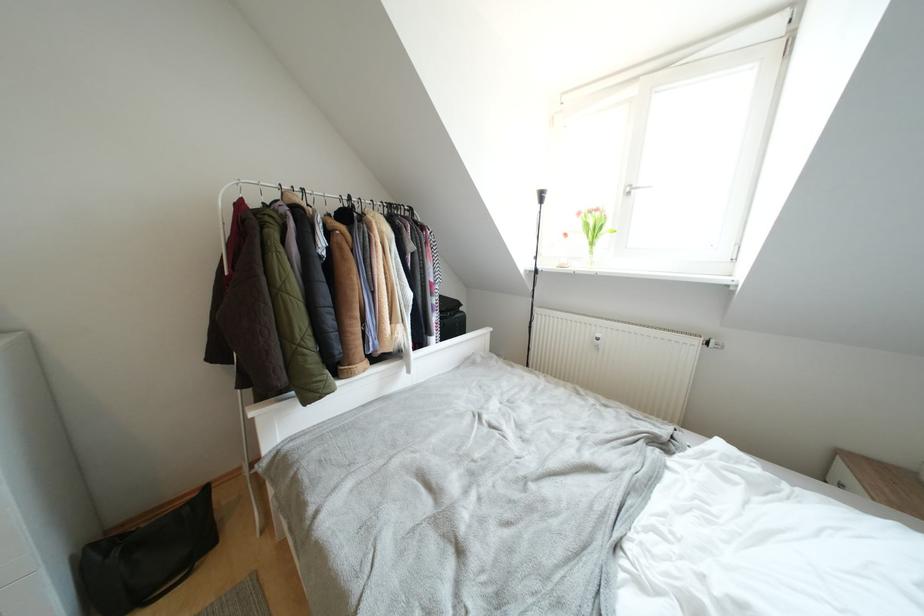
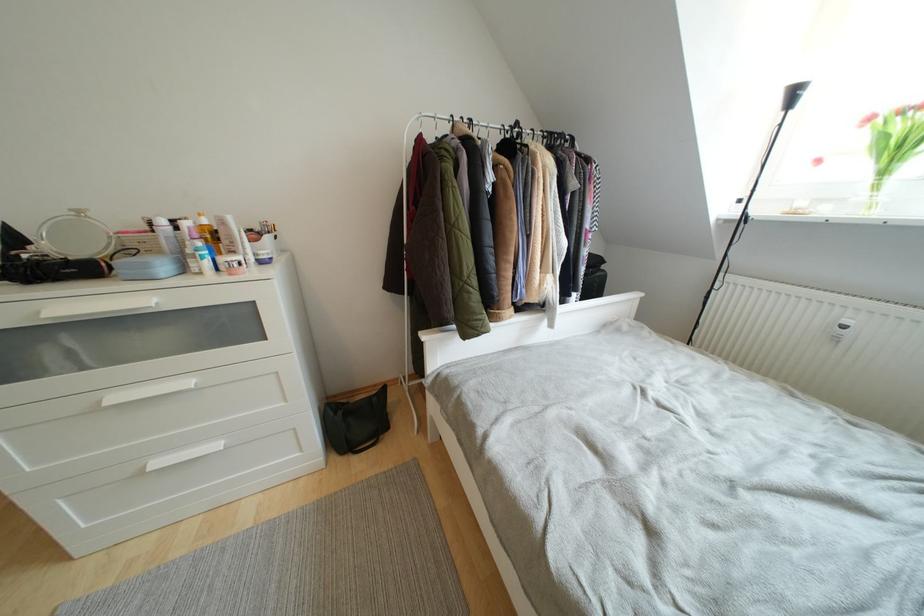
The point at (113, 559) is marked in the first image. Where is the corresponding point in the second image?

(341, 416)